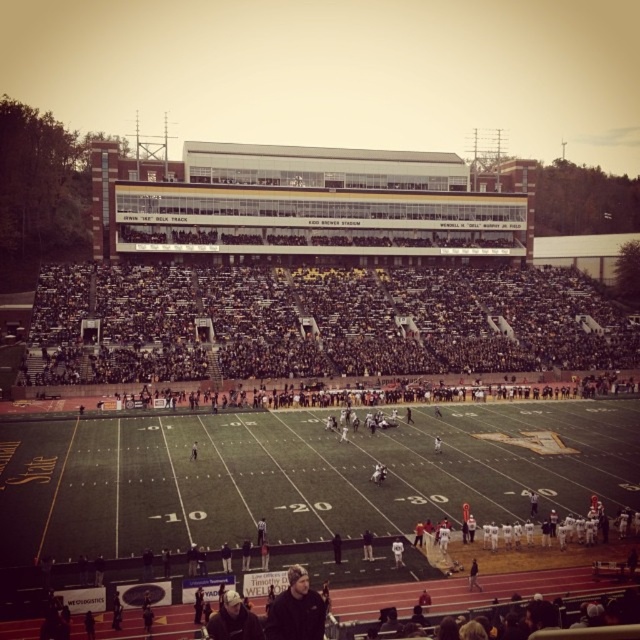
Question: Does black plastic seats at center have a larger size compared to light brown leather jacket at center?

Choices:
 (A) no
 (B) yes

Answer: (B)

Question: Observing the image, what is the correct spatial positioning of dark gray knit hat at lower center in reference to light brown leather jacket at center?

Choices:
 (A) right
 (B) left

Answer: (A)

Question: Does dark gray knit hat at lower center have a greater width compared to white jersey at center?

Choices:
 (A) yes
 (B) no

Answer: (A)

Question: Estimate the real-world distances between objects in this image. Which object is farther from the white jersey at center?

Choices:
 (A) dark gray knit hat at lower center
 (B) black plastic seats at center
 (C) black knit cap at lower center

Answer: (B)

Question: Which object is closer to the camera taking this photo?

Choices:
 (A) black plastic seats at center
 (B) dark gray knit hat at lower center
 (C) black knit cap at lower center

Answer: (C)

Question: Among these points, which one is nearest to the camera?

Choices:
 (A) (243, 621)
 (B) (396, 548)
 (C) (195, 452)

Answer: (A)